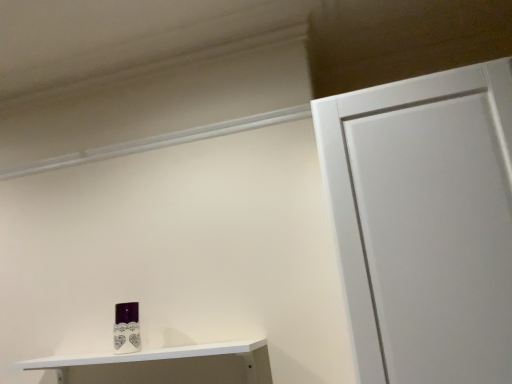
Question: Is white glossy shelf at lower left at the left side of purple glossy toiletry at lower left?

Choices:
 (A) yes
 (B) no

Answer: (B)

Question: Can you confirm if white glossy shelf at lower left is bigger than purple glossy toiletry at lower left?

Choices:
 (A) no
 (B) yes

Answer: (B)

Question: Is white glossy shelf at lower left outside purple glossy toiletry at lower left?

Choices:
 (A) no
 (B) yes

Answer: (B)

Question: Is white glossy shelf at lower left closer to camera compared to purple glossy toiletry at lower left?

Choices:
 (A) no
 (B) yes

Answer: (B)

Question: Does white glossy shelf at lower left have a lesser height compared to purple glossy toiletry at lower left?

Choices:
 (A) yes
 (B) no

Answer: (A)

Question: Does white glossy shelf at lower left contain purple glossy toiletry at lower left?

Choices:
 (A) no
 (B) yes

Answer: (A)

Question: Would you consider purple glossy toiletry at lower left to be distant from white glossy shelf at lower left?

Choices:
 (A) yes
 (B) no

Answer: (B)

Question: Is the position of purple glossy toiletry at lower left more distant than that of white glossy shelf at lower left?

Choices:
 (A) no
 (B) yes

Answer: (B)

Question: Is purple glossy toiletry at lower left taller than white glossy shelf at lower left?

Choices:
 (A) no
 (B) yes

Answer: (B)

Question: Is purple glossy toiletry at lower left in contact with white glossy shelf at lower left?

Choices:
 (A) no
 (B) yes

Answer: (A)

Question: Does purple glossy toiletry at lower left turn towards white glossy shelf at lower left?

Choices:
 (A) no
 (B) yes

Answer: (A)

Question: Considering the relative sizes of purple glossy toiletry at lower left and white glossy shelf at lower left in the image provided, is purple glossy toiletry at lower left wider than white glossy shelf at lower left?

Choices:
 (A) yes
 (B) no

Answer: (B)

Question: Is point click(119, 349) closer or farther from the camera than point click(236, 370)?

Choices:
 (A) closer
 (B) farther

Answer: (B)